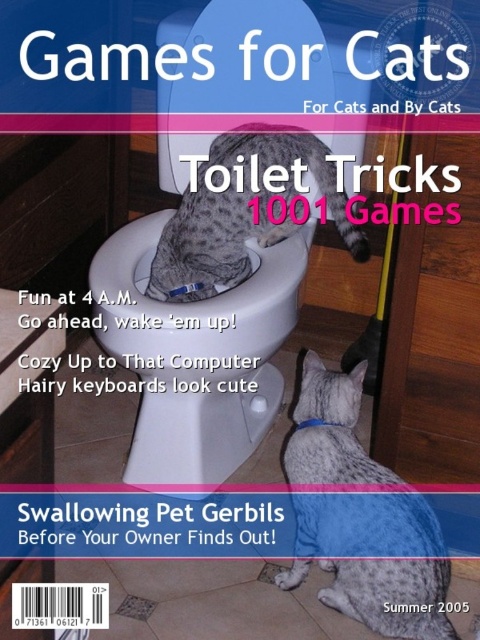
Question: Which of the following is the closest to the observer?

Choices:
 (A) (319, 388)
 (B) (244, 221)

Answer: (A)

Question: Which point is closer to the camera?

Choices:
 (A) gray spotted fur at lower right
 (B) white glossy toilet bowl at center

Answer: (A)

Question: Based on their relative distances, which object is nearer to the spotted fur cat at center?

Choices:
 (A) white glossy toilet bowl at center
 (B) gray spotted fur at lower right

Answer: (A)

Question: Does white glossy toilet bowl at center have a smaller size compared to gray spotted fur at lower right?

Choices:
 (A) no
 (B) yes

Answer: (A)

Question: In this image, where is white glossy toilet bowl at center located relative to gray spotted fur at lower right?

Choices:
 (A) below
 (B) above

Answer: (B)

Question: From the image, what is the correct spatial relationship of white glossy toilet bowl at center in relation to spotted fur cat at center?

Choices:
 (A) below
 (B) above

Answer: (A)